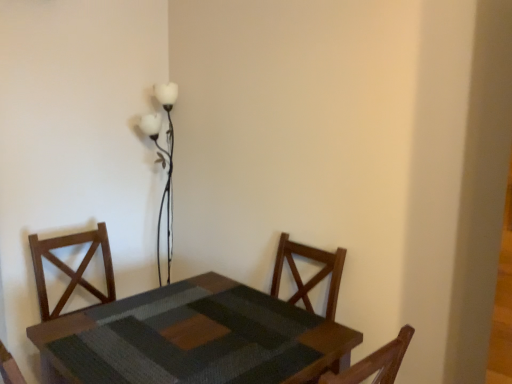
Question: Is white glass floor lamp at upper center wider than wooden textured table at center?

Choices:
 (A) no
 (B) yes

Answer: (A)

Question: Can you confirm if white glass floor lamp at upper center is positioned to the right of wooden textured table at center?

Choices:
 (A) no
 (B) yes

Answer: (A)

Question: Would you say white glass floor lamp at upper center contains wooden textured table at center?

Choices:
 (A) no
 (B) yes

Answer: (A)

Question: Is white glass floor lamp at upper center positioned behind wooden textured table at center?

Choices:
 (A) no
 (B) yes

Answer: (B)

Question: From a real-world perspective, is white glass floor lamp at upper center located beneath wooden textured table at center?

Choices:
 (A) yes
 (B) no

Answer: (B)

Question: Is white glass floor lamp at upper center to the left of wooden textured table at center from the viewer's perspective?

Choices:
 (A) yes
 (B) no

Answer: (A)

Question: From the image's perspective, is wooden textured table at center beneath white glass floor lamp at upper center?

Choices:
 (A) yes
 (B) no

Answer: (A)

Question: Could you tell me if wooden textured table at center is turned towards white glass floor lamp at upper center?

Choices:
 (A) no
 (B) yes

Answer: (A)

Question: Does wooden textured table at center have a lesser height compared to white glass floor lamp at upper center?

Choices:
 (A) yes
 (B) no

Answer: (A)

Question: Can you confirm if wooden textured table at center is positioned to the right of white glass floor lamp at upper center?

Choices:
 (A) no
 (B) yes

Answer: (B)

Question: Considering the relative sizes of wooden textured table at center and white glass floor lamp at upper center in the image provided, is wooden textured table at center wider than white glass floor lamp at upper center?

Choices:
 (A) no
 (B) yes

Answer: (B)

Question: Is wooden textured table at center taller than white glass floor lamp at upper center?

Choices:
 (A) no
 (B) yes

Answer: (A)

Question: Does point (264, 322) appear closer or farther from the camera than point (156, 119)?

Choices:
 (A) farther
 (B) closer

Answer: (B)